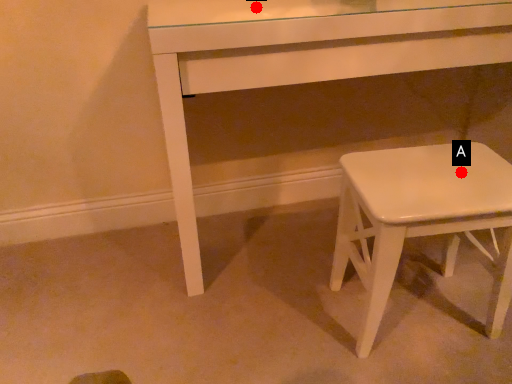
Question: Two points are circled on the image, labeled by A and B beside each circle. Which point is closer to the camera?

Choices:
 (A) A is closer
 (B) B is closer

Answer: (A)